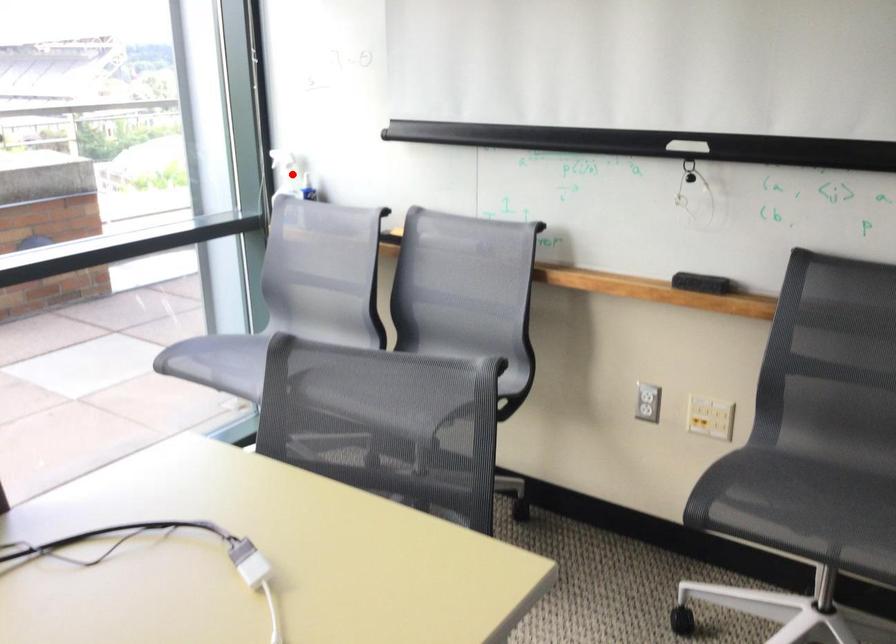
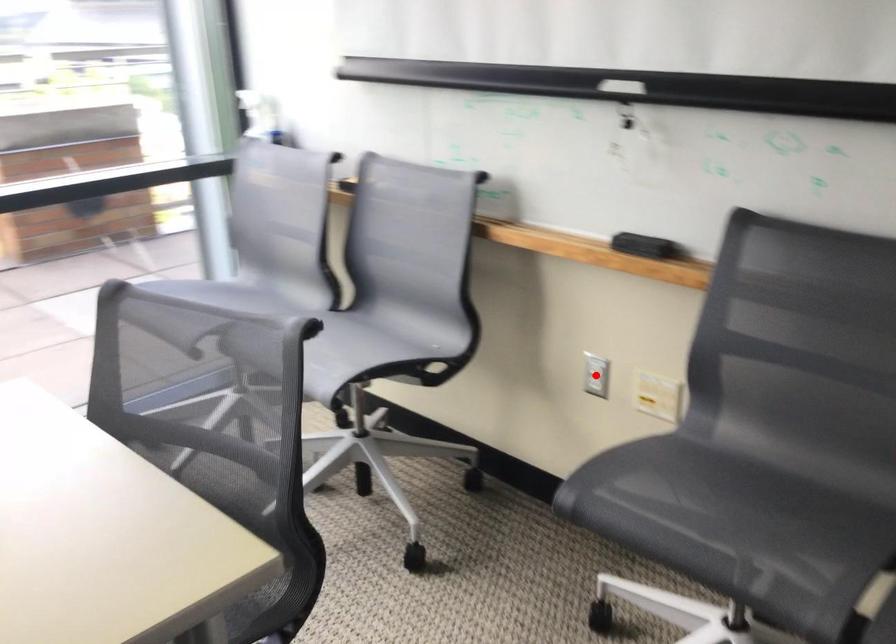
I am providing you with two images of the same scene from different viewpoints. A red point is marked on the first image and another point is marked on the second image. Do the highlighted points in image1 and image2 indicate the same real-world spot?

No